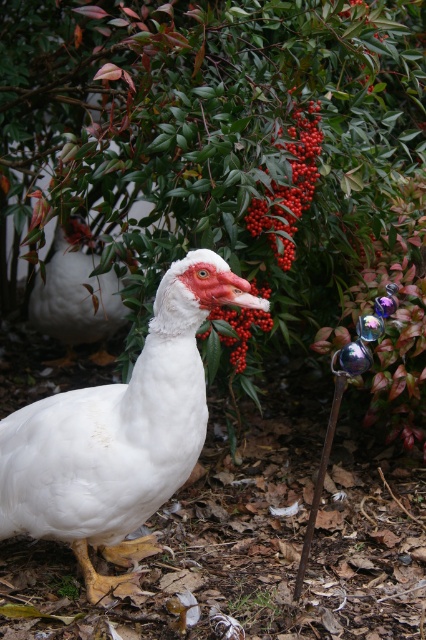
Is green leafy bush at center to the left of white matte duckbill at center from the viewer's perspective?

Indeed, green leafy bush at center is positioned on the left side of white matte duckbill at center.

Between green leafy bush at center and white matte duckbill at center, which one is positioned lower?

white matte duckbill at center is lower down.

Where is `green leafy bush at center`? Image resolution: width=426 pixels, height=640 pixels. green leafy bush at center is located at coordinates pyautogui.click(x=215, y=138).

You are a GUI agent. You are given a task and a screenshot of the screen. Output one action in this format:
    pyautogui.click(x=<x>, y=<y>)
    Task: Click on the green leafy bush at center
    
    Given the screenshot: What is the action you would take?
    pyautogui.click(x=215, y=138)

From the picture: Measure the distance from shiny red berries at center to red matte berry at center.

shiny red berries at center and red matte berry at center are 44.18 centimeters apart from each other.

Looking at this image, is shiny red berries at center further to camera compared to red matte berry at center?

No, shiny red berries at center is closer to the viewer.

Does point (287, 195) lie behind point (210, 372)?

Yes, point (287, 195) is farther from viewer.

Where is `shiny red berries at center`? The image size is (426, 640). shiny red berries at center is located at coordinates (290, 186).

Between white feathered duck at center and shiny red berries at center, which one appears on the right side from the viewer's perspective?

Positioned to the right is shiny red berries at center.

Is white feathered duck at center wider than shiny red berries at center?

Yes.

Locate an element on the screen. This screenshot has height=640, width=426. white feathered duck at center is located at coordinates (118, 436).

The height and width of the screenshot is (640, 426). In order to click on white feathered duck at center in this screenshot , I will do `click(118, 436)`.